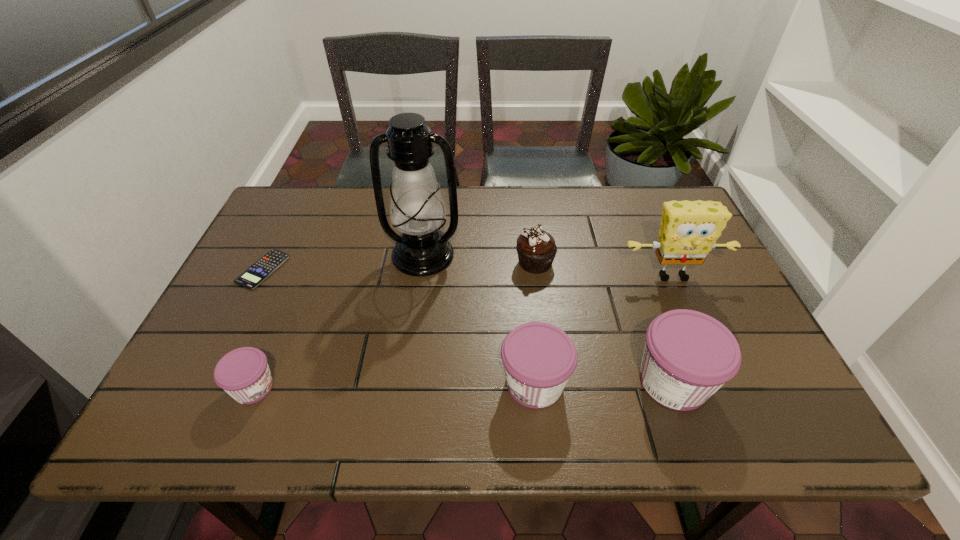
Where is `vacant area that lies between the shortest object and the sponge`? Image resolution: width=960 pixels, height=540 pixels. vacant area that lies between the shortest object and the sponge is located at coordinates (468, 273).

Find the location of a particular element. vacant point located between the oil lamp and the cupcake is located at coordinates (479, 259).

Locate an element on the screen. empty space between the sixth shortest object and the leftmost jam is located at coordinates (463, 332).

Locate an element on the screen. The image size is (960, 540). free space between the cupcake and the second shortest object is located at coordinates (395, 325).

Image resolution: width=960 pixels, height=540 pixels. I want to click on empty space that is in between the second shortest jam and the tallest object, so click(479, 319).

Find the location of a particular element. The height and width of the screenshot is (540, 960). free point between the second jam from left to right and the second shortest object is located at coordinates click(394, 386).

Locate an element on the screen. unoccupied position between the tallest object and the calculator is located at coordinates (343, 262).

Find the location of a particular element. Image resolution: width=960 pixels, height=540 pixels. free area in between the sixth shortest object and the shortest object is located at coordinates (468, 273).

Where is `the third closest object to the shortest jam`? the third closest object to the shortest jam is located at coordinates (539, 358).

You are a GUI agent. You are given a task and a screenshot of the screen. Output one action in this format:
    pyautogui.click(x=<x>, y=<y>)
    Task: Click on the object that can be found as the second closest to the second shortest jam
    Image resolution: width=960 pixels, height=540 pixels.
    Given the screenshot: What is the action you would take?
    pyautogui.click(x=536, y=248)